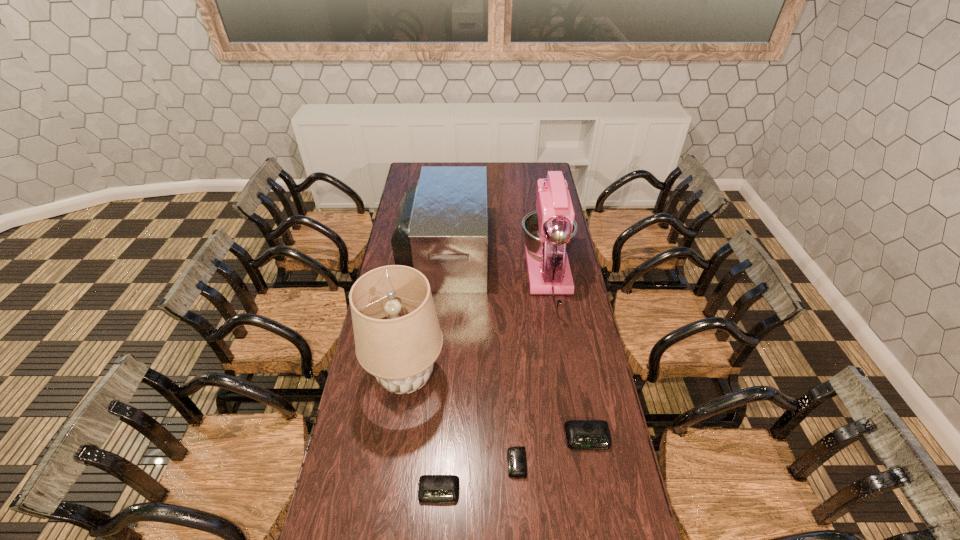
This screenshot has height=540, width=960. I want to click on free space between the mixer and the third shortest object, so click(568, 359).

The image size is (960, 540). Identify the location of vacant area that lies between the fourth nearest object and the shortest alarm clock. (462, 420).

In order to click on blank region between the microwave oven and the tallest alarm clock in this screenshot , I will do `click(516, 345)`.

Identify the location of vacant area that lies between the lampshade and the second shortest object. (422, 434).

This screenshot has width=960, height=540. Identify the location of vacant region between the second tallest alarm clock and the mixer. (494, 385).

You are a GUI agent. You are given a task and a screenshot of the screen. Output one action in this format:
    pyautogui.click(x=<x>, y=<y>)
    Task: Click on the free spot between the microwave oven and the rightmost alarm clock
    
    Given the screenshot: What is the action you would take?
    pyautogui.click(x=516, y=345)

What are the coordinates of `object that stands as the second closest to the shortest alarm clock` in the screenshot? It's located at (433, 489).

Where is `object that ranks as the closest to the mixer`? This screenshot has height=540, width=960. object that ranks as the closest to the mixer is located at coordinates (441, 230).

Locate which alarm clock ranks second in proximity to the mixer. Please provide its 2D coordinates. Your answer should be formatted as a tuple, i.e. [(x, y)], where the tuple contains the x and y coordinates of a point satisfying the conditions above.

[(516, 456)]

Locate an element on the screen. This screenshot has width=960, height=540. alarm clock that stands as the closest to the second shortest alarm clock is located at coordinates (516, 456).